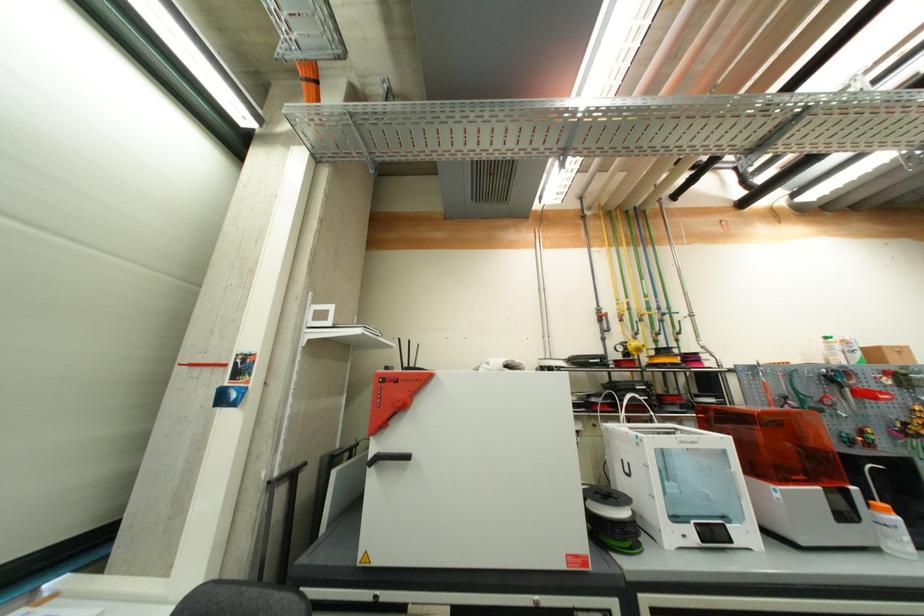
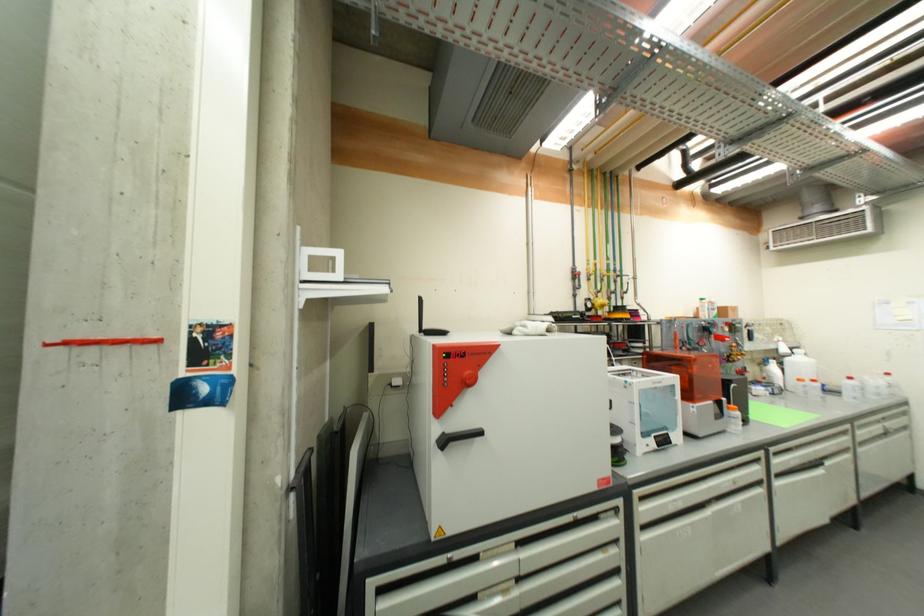
Locate, in the second image, the point that corresponds to pixel 891 513 in the first image.

(739, 411)